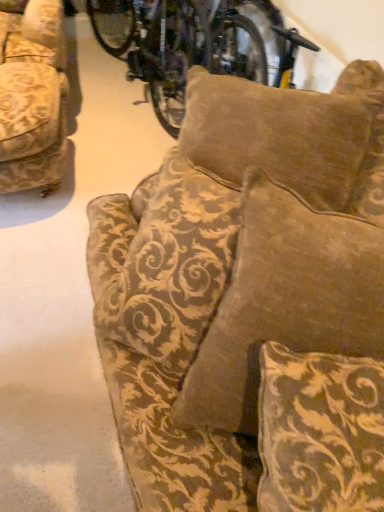
Question: Considering the positions of velvet gold-patterned couch at center, arranged as the first studio couch when viewed from the front, and metallic silver bicycle at upper center in the image, is velvet gold-patterned couch at center, arranged as the first studio couch when viewed from the front, wider or thinner than metallic silver bicycle at upper center?

Choices:
 (A) wide
 (B) thin

Answer: (A)

Question: From a real-world perspective, is velvet gold-patterned couch at center, the 2th studio couch viewed from the back, positioned above or below metallic silver bicycle at upper center?

Choices:
 (A) below
 (B) above

Answer: (B)

Question: Which object is positioned farthest from the velvet gold-patterned pillow at center, which is the first pillow in bottom-to-top order?

Choices:
 (A) metallic silver bicycle at upper center
 (B) brown velvety pillow at upper center, the 2th pillow from the front
 (C) velvet gold-patterned couch at center, arranged as the first studio couch when viewed from the front
 (D) gold-patterned fabric couch at left, which is the first studio couch from back to front

Answer: (A)

Question: Which of these objects is positioned farthest from the brown velvety pillow at upper center, the 1th pillow positioned from the back?

Choices:
 (A) metallic silver bicycle at upper center
 (B) velvet gold-patterned pillow at center, the 1th pillow from the front
 (C) velvet gold-patterned couch at center, positioned as the first studio couch in right-to-left order
 (D) gold-patterned fabric couch at left, the 2th studio couch viewed from the front

Answer: (A)